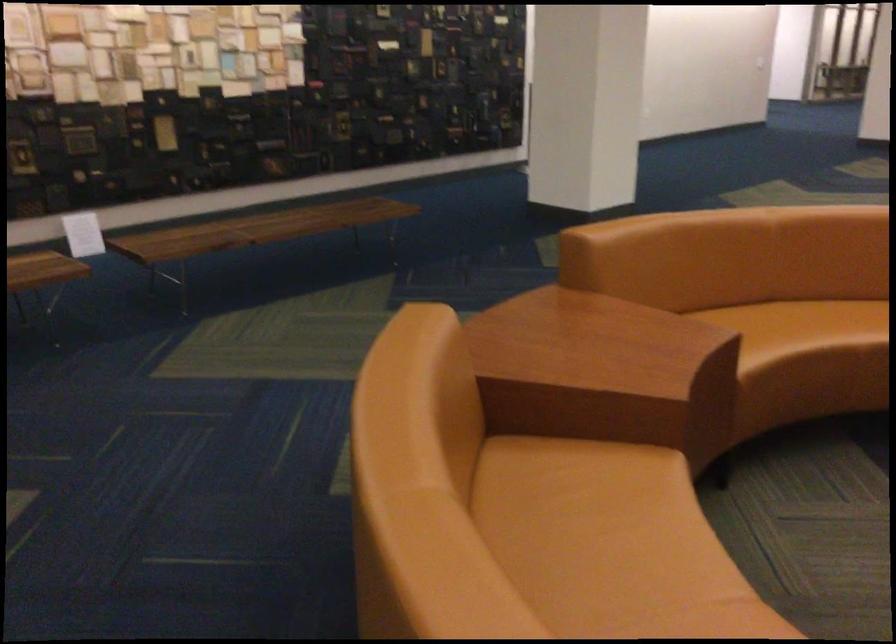
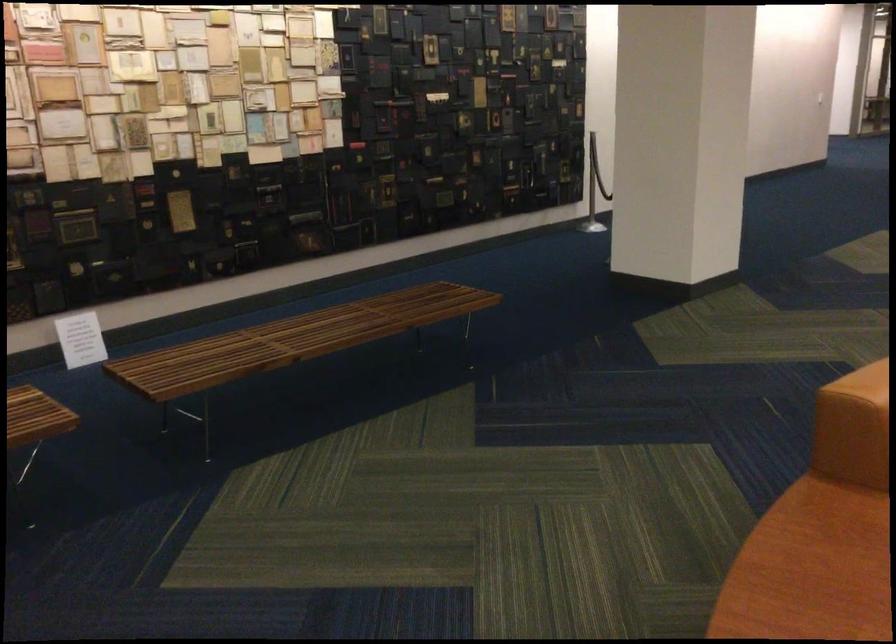
Locate, in the second image, the point that corresponds to [527,319] in the first image.

(811, 569)